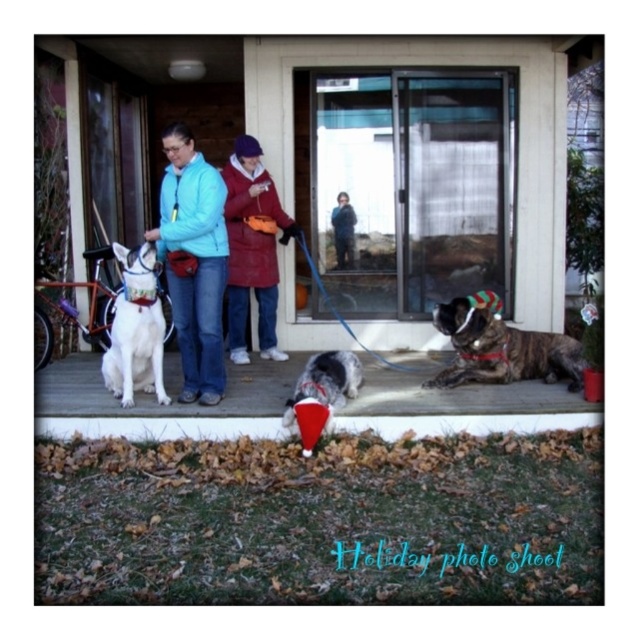
You are organizing a photo shoot for a pet magazine and need to arrange the white fabric dog at center and the red woolen sweater at center so that the dog looks bigger than the sweater. According to the scene description, is this arrangement possible?

The white fabric dog at center has a lesser height compared to red woolen sweater at center, so arranging it to look bigger might not be possible based on their actual sizes.

You are organizing a photo shoot on the porch. You have a white fabric dog at center and a red woolen sweater at center. Which object should you move to the right to make space for a new prop?

You should move the white fabric dog at center to the right since it is currently on the left side of the red woolen sweater at center, allowing space to the right for the new prop.